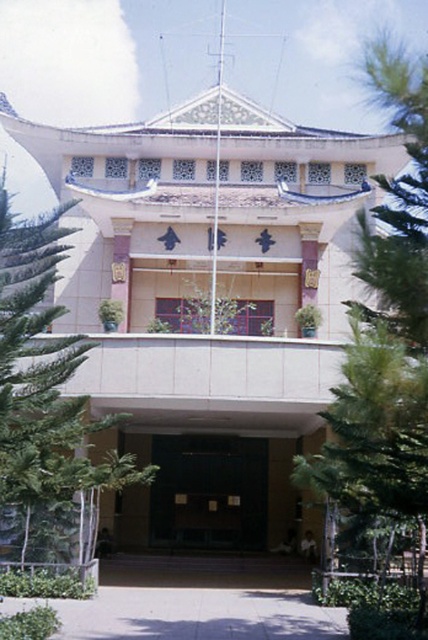
This screenshot has height=640, width=428. What do you see at coordinates (386, 353) in the screenshot? I see `green leafy tree at right` at bounding box center [386, 353].

Where is `green leafy tree at right`? This screenshot has height=640, width=428. green leafy tree at right is located at coordinates (386, 353).

Who is positioned more to the right, green leafy tree at right or green leafy tree at left?

green leafy tree at right is more to the right.

Identify the location of green leafy tree at right. This screenshot has width=428, height=640. (386, 353).

Is green leafy tree at left wider than black glass door at center?

Yes.

Which is more to the right, green leafy tree at left or black glass door at center?

black glass door at center is more to the right.

Does point (26, 221) lie behind point (196, 486)?

No, it is in front of (196, 486).

Find the location of a particular element. green leafy tree at left is located at coordinates (45, 385).